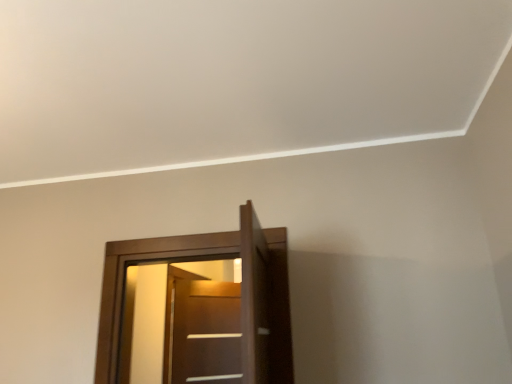
At what (x,y) coordinates should I click in order to perform the action: click on matte brown screen door at center. Please return your answer as a coordinate pair (x, y). This screenshot has width=512, height=384. Looking at the image, I should click on (206, 332).

What do you see at coordinates (206, 332) in the screenshot?
I see `matte brown screen door at center` at bounding box center [206, 332].

You are a GUI agent. You are given a task and a screenshot of the screen. Output one action in this format:
    pyautogui.click(x=<x>, y=<y>)
    Task: Click on the matte brown screen door at center
    
    Given the screenshot: What is the action you would take?
    pyautogui.click(x=206, y=332)